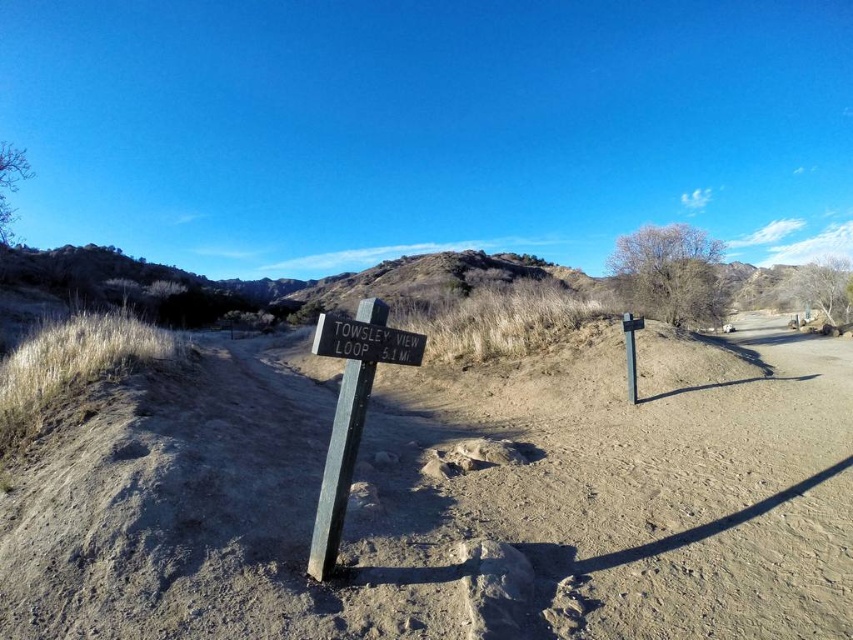
You are a hiker planning to walk along the brown sandy dirt track at center and pass by the wooden sign at center. Which object will you encounter first as you start walking forward?

You will encounter the brown sandy dirt track at center first because it is closer to you than the wooden sign at center.